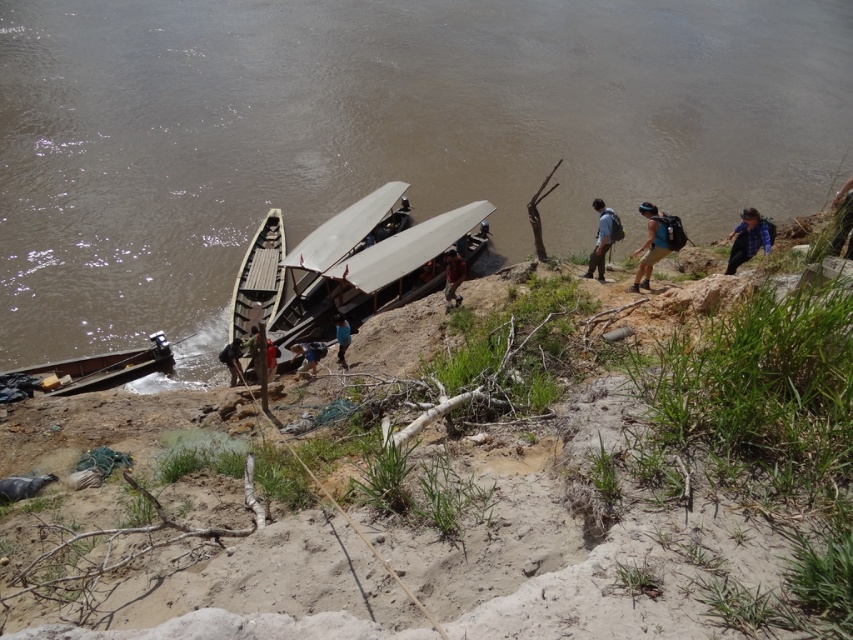
Question: Which point is farther from the camera taking this photo?

Choices:
 (A) (566, 195)
 (B) (317, 353)
 (C) (335, 321)

Answer: (A)

Question: Does blue fabric backpack at center-right appear under blue fabric person at center?

Choices:
 (A) no
 (B) yes

Answer: (A)

Question: Does wooden boat at center have a larger size compared to dark blue fabric person at lower left?

Choices:
 (A) no
 (B) yes

Answer: (B)

Question: Which of the following is the farthest from the observer?

Choices:
 (A) (659, 108)
 (B) (763, 237)

Answer: (A)

Question: Which is nearer to the brown muddy water at lower left?

Choices:
 (A) dark blue fabric person at lower left
 (B) blue fabric person at center
 (C) blue backpack at center
 (D) blue fabric backpack at upper right

Answer: (A)

Question: Is blue fabric backpack at center-right to the left of dark blue fabric person at lower left from the viewer's perspective?

Choices:
 (A) no
 (B) yes

Answer: (A)